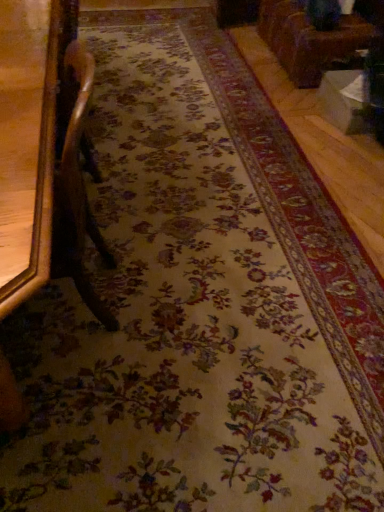
In order to click on brown polished wood chair at left, the 1th furniture when ordered from bottom to top in this screenshot , I will do `click(28, 141)`.

Describe the element at coordinates (28, 141) in the screenshot. I see `brown polished wood chair at left, the 1th furniture when ordered from bottom to top` at that location.

Describe the element at coordinates (317, 38) in the screenshot. The image size is (384, 512). I see `brown leather couch at upper right, placed as the 1th furniture when sorted from top to bottom` at that location.

Where is `brown leather couch at upper right, marked as the 2th furniture in a left-to-right arrangement`? The height and width of the screenshot is (512, 384). brown leather couch at upper right, marked as the 2th furniture in a left-to-right arrangement is located at coordinates (317, 38).

The width and height of the screenshot is (384, 512). Identify the location of brown polished wood chair at left, arranged as the first furniture when viewed from the left. (28, 141).

Which object is positioned more to the right, brown leather couch at upper right, the 1th furniture in the back-to-front sequence, or brown polished wood chair at left, which is the second furniture in right-to-left order?

brown leather couch at upper right, the 1th furniture in the back-to-front sequence.

In the image, is brown leather couch at upper right, the second furniture from the bottom, positioned in front of or behind brown polished wood chair at left, arranged as the first furniture when viewed from the left?

brown leather couch at upper right, the second furniture from the bottom, is behind brown polished wood chair at left, arranged as the first furniture when viewed from the left.

Which point is more forward, (320, 68) or (62, 19)?

The point (62, 19) is closer.

From the image's perspective, would you say brown leather couch at upper right, placed as the 1th furniture when sorted from top to bottom, is positioned over brown polished wood chair at left, arranged as the first furniture when viewed from the left?

Yes, from the image's perspective, brown leather couch at upper right, placed as the 1th furniture when sorted from top to bottom, is on top of brown polished wood chair at left, arranged as the first furniture when viewed from the left.

From a real-world perspective, is brown leather couch at upper right, marked as the 2th furniture in a left-to-right arrangement, physically below brown polished wood chair at left, arranged as the first furniture when viewed from the left?

Yes.

Between brown leather couch at upper right, the 1th furniture in the back-to-front sequence, and brown polished wood chair at left, which is the second furniture in back-to-front order, which one has larger width?

With larger width is brown leather couch at upper right, the 1th furniture in the back-to-front sequence.

Between brown leather couch at upper right, the second furniture from the bottom, and brown polished wood chair at left, arranged as the first furniture when viewed from the left, which one has less height?

brown leather couch at upper right, the second furniture from the bottom.

Is brown leather couch at upper right, the second furniture when ordered from front to back, bigger or smaller than brown polished wood chair at left, which appears as the first furniture when viewed from the front?

brown leather couch at upper right, the second furniture when ordered from front to back, is bigger than brown polished wood chair at left, which appears as the first furniture when viewed from the front.

Is brown polished wood chair at left, arranged as the first furniture when viewed from the left, a part of brown leather couch at upper right, placed as the 1th furniture when sorted from top to bottom?

No, brown leather couch at upper right, placed as the 1th furniture when sorted from top to bottom, does not contain brown polished wood chair at left, arranged as the first furniture when viewed from the left.

Is brown leather couch at upper right, the first furniture when ordered from right to left, in contact with brown polished wood chair at left, the second furniture from the top?

No, brown leather couch at upper right, the first furniture when ordered from right to left, is not next to brown polished wood chair at left, the second furniture from the top.

Is brown leather couch at upper right, the first furniture when ordered from right to left, facing away from brown polished wood chair at left, the 1th furniture when ordered from bottom to top?

No, brown leather couch at upper right, the first furniture when ordered from right to left, is not facing away from brown polished wood chair at left, the 1th furniture when ordered from bottom to top.

How far apart are brown leather couch at upper right, the second furniture when ordered from front to back, and brown polished wood chair at left, which appears as the first furniture when viewed from the front?

They are 6.19 feet apart.

At what (x,y) coordinates should I click in order to perform the action: click on furniture that is above the brown leather couch at upper right, the second furniture when ordered from front to back (from a real-world perspective). Please return your answer as a coordinate pair (x, y). This screenshot has width=384, height=512. Looking at the image, I should click on (28, 141).

Is brown polished wood chair at left, which is the second furniture in right-to-left order, to the left or to the right of brown leather couch at upper right, the 1th furniture in the back-to-front sequence, in the image?

brown polished wood chair at left, which is the second furniture in right-to-left order, is positioned on brown leather couch at upper right, the 1th furniture in the back-to-front sequence,'s left side.

Is brown polished wood chair at left, which is the second furniture in back-to-front order, closer to the viewer compared to brown leather couch at upper right, the first furniture when ordered from right to left?

Yes.

Is point (10, 120) positioned before point (363, 39)?

That is True.

From the image's perspective, would you say brown polished wood chair at left, which is the second furniture in right-to-left order, is positioned over brown leather couch at upper right, placed as the 1th furniture when sorted from top to bottom?

Actually, brown polished wood chair at left, which is the second furniture in right-to-left order, appears below brown leather couch at upper right, placed as the 1th furniture when sorted from top to bottom, in the image.

From a real-world perspective, between brown polished wood chair at left, the 1th furniture when ordered from bottom to top, and brown leather couch at upper right, the second furniture from the bottom, who is vertically higher?

From a 3D spatial view, brown polished wood chair at left, the 1th furniture when ordered from bottom to top, is above.

Does brown polished wood chair at left, which is the second furniture in back-to-front order, have a greater width compared to brown leather couch at upper right, the second furniture from the bottom?

Incorrect, the width of brown polished wood chair at left, which is the second furniture in back-to-front order, does not surpass that of brown leather couch at upper right, the second furniture from the bottom.

In terms of height, does brown polished wood chair at left, which is the second furniture in back-to-front order, look taller or shorter compared to brown leather couch at upper right, placed as the 1th furniture when sorted from top to bottom?

Clearly, brown polished wood chair at left, which is the second furniture in back-to-front order, is taller compared to brown leather couch at upper right, placed as the 1th furniture when sorted from top to bottom.

Based on the photo, considering the relative sizes of brown polished wood chair at left, arranged as the first furniture when viewed from the left, and brown leather couch at upper right, the first furniture when ordered from right to left, in the image provided, is brown polished wood chair at left, arranged as the first furniture when viewed from the left, bigger than brown leather couch at upper right, the first furniture when ordered from right to left,?

Incorrect, brown polished wood chair at left, arranged as the first furniture when viewed from the left, is not larger than brown leather couch at upper right, the first furniture when ordered from right to left.

Is brown polished wood chair at left, which is the second furniture in back-to-front order, surrounding brown leather couch at upper right, the 1th furniture in the back-to-front sequence?

No, brown leather couch at upper right, the 1th furniture in the back-to-front sequence, is not surrounded by brown polished wood chair at left, which is the second furniture in back-to-front order.

Is brown polished wood chair at left, the second furniture from the top, placed right next to brown leather couch at upper right, the 1th furniture in the back-to-front sequence?

No, brown polished wood chair at left, the second furniture from the top, is not with brown leather couch at upper right, the 1th furniture in the back-to-front sequence.

Is brown polished wood chair at left, which is the second furniture in back-to-front order, looking in the opposite direction of brown leather couch at upper right, the 1th furniture in the back-to-front sequence?

brown polished wood chair at left, which is the second furniture in back-to-front order, does not have its back to brown leather couch at upper right, the 1th furniture in the back-to-front sequence.

Can you tell me how much brown polished wood chair at left, the second furniture from the top, and brown leather couch at upper right, the second furniture when ordered from front to back, differ in facing direction?

Answer: The angle between the facing direction of brown polished wood chair at left, the second furniture from the top, and the facing direction of brown leather couch at upper right, the second furniture when ordered from front to back, is 4.45 degrees.

How much distance is there between brown polished wood chair at left, which is the second furniture in right-to-left order, and brown leather couch at upper right, the 1th furniture in the back-to-front sequence?

They are 6.19 feet apart.

At what (x,y) coordinates should I click in order to perform the action: click on furniture on the right of brown polished wood chair at left, which is the second furniture in right-to-left order. Please return your answer as a coordinate pair (x, y). The width and height of the screenshot is (384, 512). Looking at the image, I should click on (317, 38).

I want to click on furniture in front of the brown leather couch at upper right, placed as the 1th furniture when sorted from top to bottom, so pos(28,141).

You are a GUI agent. You are given a task and a screenshot of the screen. Output one action in this format:
    pyautogui.click(x=<x>, y=<y>)
    Task: Click on the furniture located above the brown leather couch at upper right, the second furniture from the bottom (from a real-world perspective)
    The width and height of the screenshot is (384, 512).
    Given the screenshot: What is the action you would take?
    pyautogui.click(x=28, y=141)